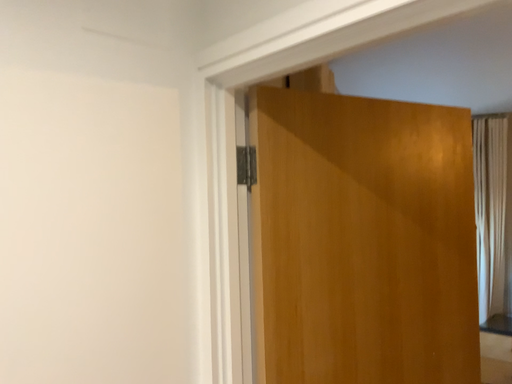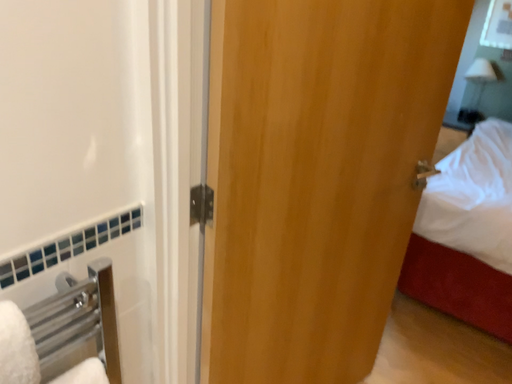
Question: Which way did the camera rotate in the video?

Choices:
 (A) rotated upward
 (B) rotated downward

Answer: (B)